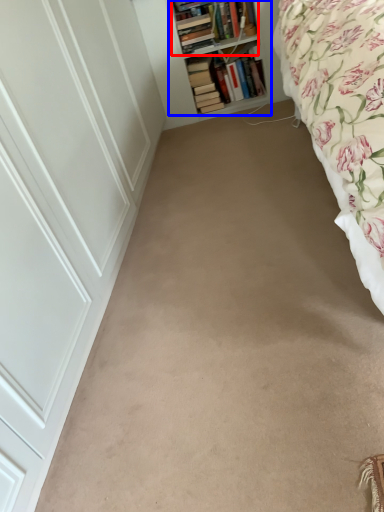
Question: Which of the following is the closest to the observer, book (highlighted by a red box) or shelf (highlighted by a blue box)?

Choices:
 (A) book
 (B) shelf

Answer: (B)